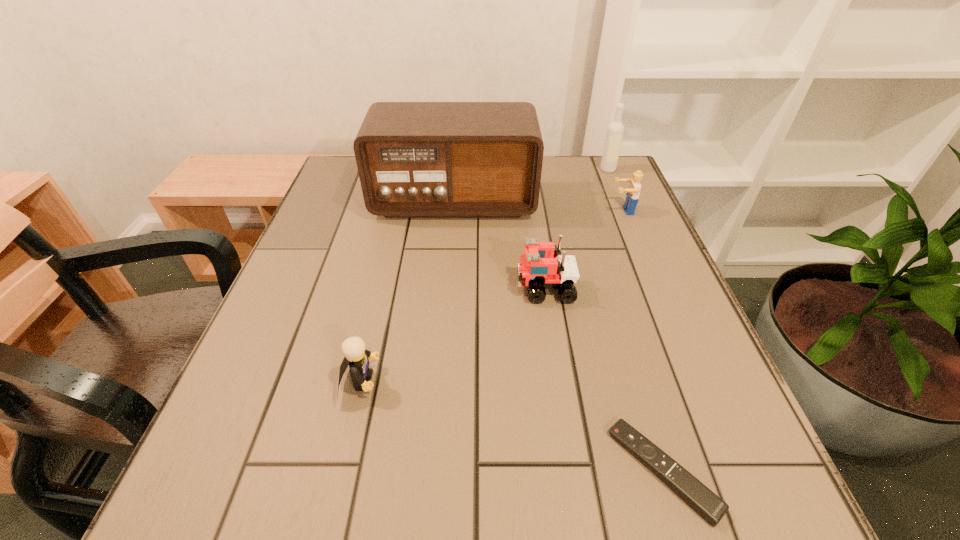
In the image, there is a desktop. At what (x,y) coordinates should I click in order to perform the action: click on vacant space at the near edge. Please return your answer as a coordinate pair (x, y). Looking at the image, I should click on (589, 528).

In the image, there is a desktop. Where is `vacant space at the left edge`? The height and width of the screenshot is (540, 960). vacant space at the left edge is located at coordinates (280, 356).

Where is `free region at the right edge`? free region at the right edge is located at coordinates (600, 239).

Image resolution: width=960 pixels, height=540 pixels. I want to click on vacant region at the far right corner, so click(x=598, y=171).

The height and width of the screenshot is (540, 960). Find the location of `free spot between the fifth shortest object and the remote control`. free spot between the fifth shortest object and the remote control is located at coordinates (636, 320).

I want to click on free space between the farthest object and the farthest Lego, so click(x=614, y=190).

Image resolution: width=960 pixels, height=540 pixels. Identify the location of vacant area that lies between the tallest object and the second Lego from right to left. (499, 245).

Image resolution: width=960 pixels, height=540 pixels. I want to click on vacant space that is in between the vodka and the second Lego from left to right, so click(x=576, y=229).

Where is `vacant area that lies between the tallest object and the remote control`? The height and width of the screenshot is (540, 960). vacant area that lies between the tallest object and the remote control is located at coordinates (559, 335).

At what (x,y) coordinates should I click in order to perform the action: click on free spot between the second nearest Lego and the radio receiver. Please return your answer as a coordinate pair (x, y). This screenshot has height=540, width=960. Looking at the image, I should click on (499, 245).